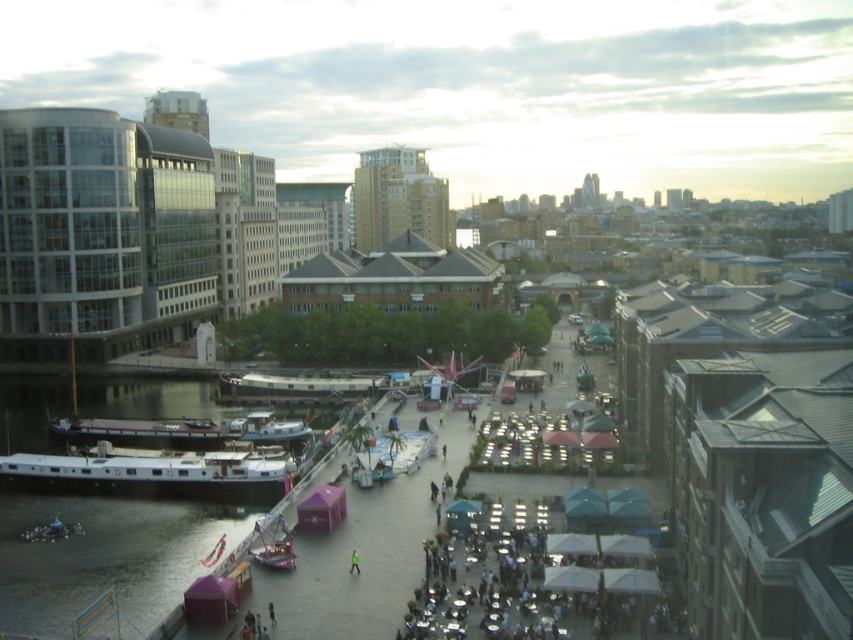
You are standing at the center of the paved area in the urban riverside scene. You want to find the transparent glass boat at lower center. According to the coordinates provided, in which direction should you look to locate it?

The transparent glass boat at lower center is located at coordinates point (273, 545), which means you should look towards the lower right direction from your current position at the center to find it.

In the scene shown: You are a photographer aiming to capture both the white glossy boat at lower left and the transparent glass boat at lower center in a single shot. Given their positions, which boat should you position closer to the left side of your camera frame to include both effectively?

The white glossy boat at lower left is to the left of transparent glass boat at lower center, so you should position the white glossy boat at lower left closer to the left side of your camera frame to include both effectively.